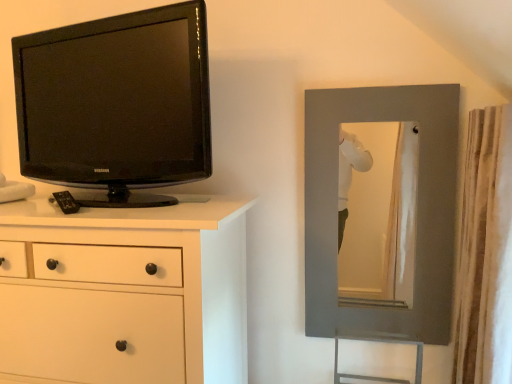
Describe the element at coordinates (117, 103) in the screenshot. The height and width of the screenshot is (384, 512). I see `black glossy tv at left` at that location.

In order to click on white textured curtain at right in this screenshot , I will do `click(479, 246)`.

The image size is (512, 384). In order to click on matte gray mirror at right in this screenshot , I will do coord(416,211).

At what (x,y) coordinates should I click in order to perform the action: click on white matte chest of drawers at left. Please return your answer as a coordinate pair (x, y). Image resolution: width=512 pixels, height=384 pixels. Looking at the image, I should click on (124, 293).

Locate an element on the screen. curtain that appears below the matte gray mirror at right (from a real-world perspective) is located at coordinates (479, 246).

Is matte gray mirror at right looking in the opposite direction of white textured curtain at right?

No, matte gray mirror at right's orientation is not away from white textured curtain at right.

Who is shorter, matte gray mirror at right or white textured curtain at right?

Standing shorter between the two is matte gray mirror at right.

Looking at this image, which is more to the right, white textured curtain at right or white matte chest of drawers at left?

white textured curtain at right.

Is white textured curtain at right beside white matte chest of drawers at left?

white textured curtain at right is not next to white matte chest of drawers at left, and they're not touching.

Consider the image. Is white matte chest of drawers at left completely or partially inside white textured curtain at right?

No, white matte chest of drawers at left is not inside white textured curtain at right.

Is black glossy tv at left closer to camera compared to white matte chest of drawers at left?

No.

From the image's perspective, is black glossy tv at left on top of white matte chest of drawers at left?

Indeed, from the image's perspective, black glossy tv at left is shown above white matte chest of drawers at left.

Considering the positions of objects black glossy tv at left and white matte chest of drawers at left in the image provided, who is more to the right, black glossy tv at left or white matte chest of drawers at left?

Positioned to the right is black glossy tv at left.

Is black glossy tv at left with white matte chest of drawers at left?

black glossy tv at left and white matte chest of drawers at left are clearly separated.

From the image's perspective, is white matte chest of drawers at left on matte gray mirror at right?

Incorrect, from the image's perspective, white matte chest of drawers at left is lower than matte gray mirror at right.

Which object is thinner, white matte chest of drawers at left or matte gray mirror at right?

With smaller width is matte gray mirror at right.

Does point (221, 251) appear closer or farther from the camera than point (416, 200)?

Point (221, 251).

Does white matte chest of drawers at left touch matte gray mirror at right?

They are not placed beside each other.

Considering the sizes of black glossy tv at left and matte gray mirror at right in the image, is black glossy tv at left taller or shorter than matte gray mirror at right?

In the image, black glossy tv at left appears to be shorter than matte gray mirror at right.

Is black glossy tv at left wider than matte gray mirror at right?

Correct, the width of black glossy tv at left exceeds that of matte gray mirror at right.

From a real-world perspective, is black glossy tv at left located higher than matte gray mirror at right?

Yes.

Considering the relative sizes of black glossy tv at left and matte gray mirror at right in the image provided, is black glossy tv at left bigger than matte gray mirror at right?

Yes.

From a real-world perspective, which object stands above the other?

From a 3D spatial view, black glossy tv at left is above.

Considering the relative positions of black glossy tv at left and white textured curtain at right in the image provided, is black glossy tv at left to the left or to the right of white textured curtain at right?

black glossy tv at left is positioned on white textured curtain at right's left side.

In the scene shown: Is black glossy tv at left spatially inside white textured curtain at right, or outside of it?

black glossy tv at left lies outside white textured curtain at right.

Locate an element on the screen. The image size is (512, 384). television located above the white matte chest of drawers at left (from the image's perspective) is located at coordinates (117, 103).

Does white matte chest of drawers at left have a lesser height compared to black glossy tv at left?

No.

Is white matte chest of drawers at left positioned beyond the bounds of black glossy tv at left?

Absolutely, white matte chest of drawers at left is external to black glossy tv at left.

Considering their positions, is white matte chest of drawers at left located in front of or behind black glossy tv at left?

Visually, white matte chest of drawers at left is located in front of black glossy tv at left.

The width and height of the screenshot is (512, 384). Identify the location of picture frame on the left of white textured curtain at right. (416, 211).

Where is `curtain positioned vertically above the white matte chest of drawers at left (from a real-world perspective)`? curtain positioned vertically above the white matte chest of drawers at left (from a real-world perspective) is located at coordinates (479, 246).

Considering their positions, is white textured curtain at right positioned further to matte gray mirror at right than white matte chest of drawers at left?

white matte chest of drawers at left is further to matte gray mirror at right.

Based on their spatial positions, is white matte chest of drawers at left or white textured curtain at right closer to black glossy tv at left?

white matte chest of drawers at left lies closer to black glossy tv at left than the other object.

Considering their positions, is white textured curtain at right positioned further to white matte chest of drawers at left than matte gray mirror at right?

Based on the image, white textured curtain at right appears to be further to white matte chest of drawers at left.

Estimate the real-world distances between objects in this image. Which object is further from black glossy tv at left, white matte chest of drawers at left or matte gray mirror at right?

matte gray mirror at right.

Based on their spatial positions, is matte gray mirror at right or black glossy tv at left further from white textured curtain at right?

black glossy tv at left lies further to white textured curtain at right than the other object.

Looking at the image, which one is located closer to matte gray mirror at right, black glossy tv at left or white textured curtain at right?

The object closer to matte gray mirror at right is white textured curtain at right.

Based on their spatial positions, is matte gray mirror at right or white textured curtain at right closer to white matte chest of drawers at left?

matte gray mirror at right.

Considering their positions, is white textured curtain at right positioned further to black glossy tv at left than white matte chest of drawers at left?

Among the two, white textured curtain at right is located further to black glossy tv at left.

Locate an element on the screen. The height and width of the screenshot is (384, 512). television situated between white matte chest of drawers at left and white textured curtain at right from left to right is located at coordinates (117, 103).

Where is `picture frame situated between black glossy tv at left and white textured curtain at right from left to right`? picture frame situated between black glossy tv at left and white textured curtain at right from left to right is located at coordinates (416, 211).

The image size is (512, 384). I want to click on television located between white matte chest of drawers at left and matte gray mirror at right in the left-right direction, so click(117, 103).

Where is `picture frame between white matte chest of drawers at left and white textured curtain at right in the horizontal direction`? picture frame between white matte chest of drawers at left and white textured curtain at right in the horizontal direction is located at coordinates (416, 211).